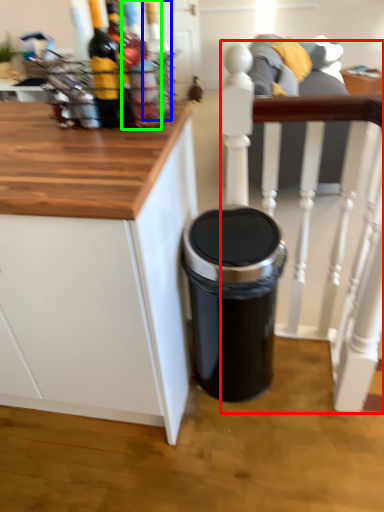
Question: Which is nearer to the chair (highlighted by a red box)? bottle (highlighted by a blue box) or bottle (highlighted by a green box).

Choices:
 (A) bottle
 (B) bottle

Answer: (B)